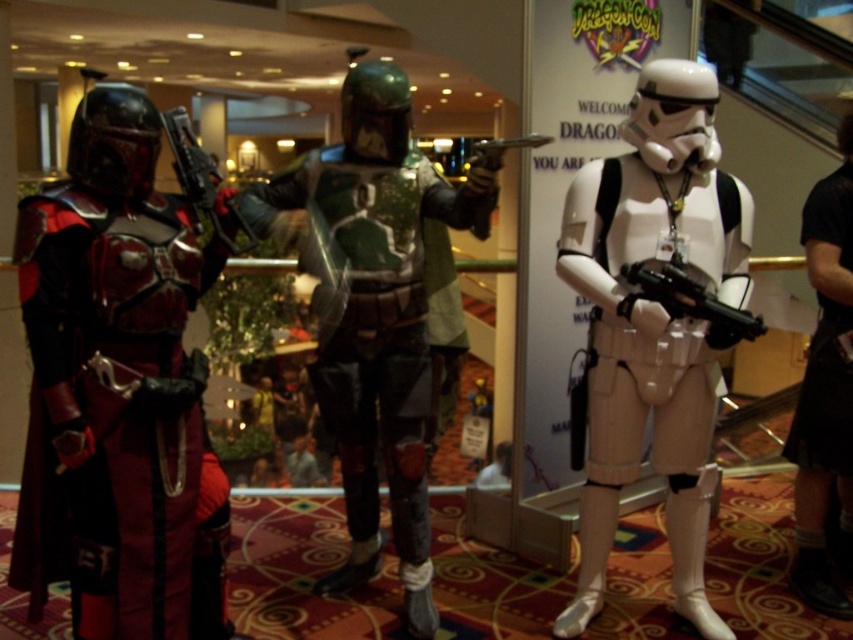
Question: Based on their relative distances, which object is farther from the green camouflage armor at center?

Choices:
 (A) matte black gun at center
 (B) matte black gun at left
 (C) black leather pants at lower right

Answer: (C)

Question: Can you confirm if green camouflage armor at center is bigger than matte black gun at left?

Choices:
 (A) no
 (B) yes

Answer: (B)

Question: Which is nearer to the metallic silver gun at center?

Choices:
 (A) black leather pants at lower right
 (B) green camouflage armor at center
 (C) white matte stormtrooper at center

Answer: (C)

Question: Which object is the closest to the black leather pants at lower right?

Choices:
 (A) matte black gun at center
 (B) shiny red armor at left
 (C) matte black gun at left
 (D) metallic silver gun at center

Answer: (A)

Question: In this image, where is white matte stormtrooper at center located relative to matte black gun at left?

Choices:
 (A) right
 (B) left

Answer: (A)

Question: Does black leather pants at lower right have a larger size compared to matte black gun at left?

Choices:
 (A) no
 (B) yes

Answer: (B)